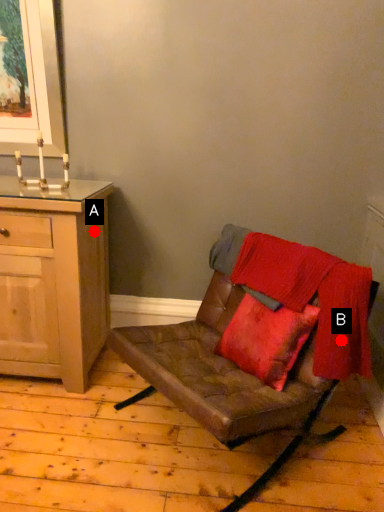
Question: Two points are circled on the image, labeled by A and B beside each circle. Among these points, which one is nearest to the camera?

Choices:
 (A) A is closer
 (B) B is closer

Answer: (B)